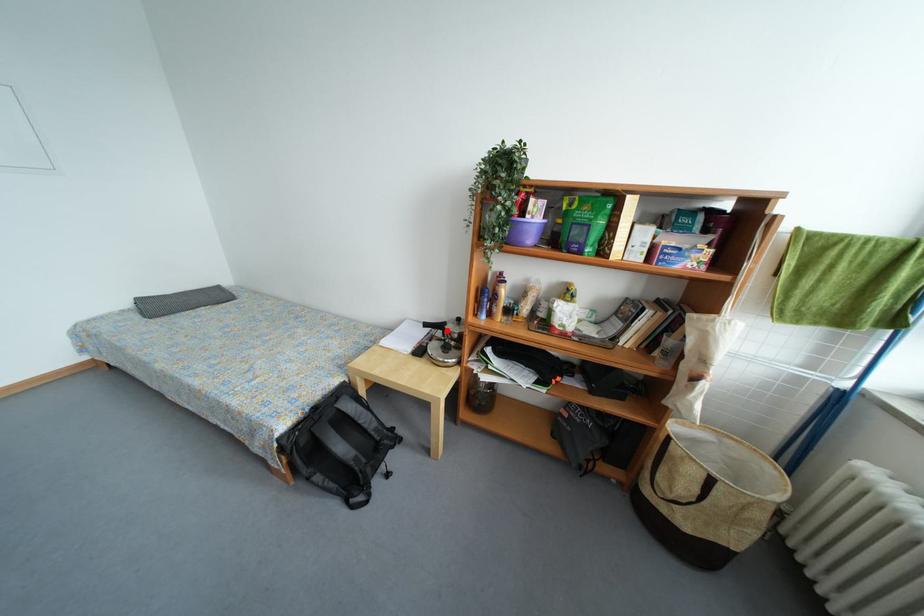
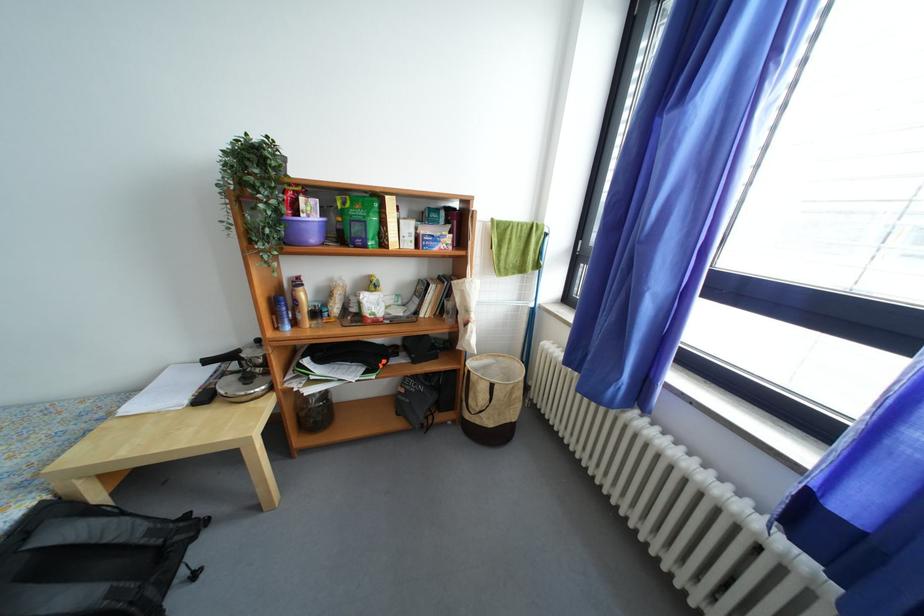
Question: A red point is marked in image1. In image2, is the corresponding 3D point closer to the camera or farther? Reply with the corresponding letter.

Choices:
 (A) The corresponding 3D point is closer.
 (B) The corresponding 3D point is farther.

Answer: (B)